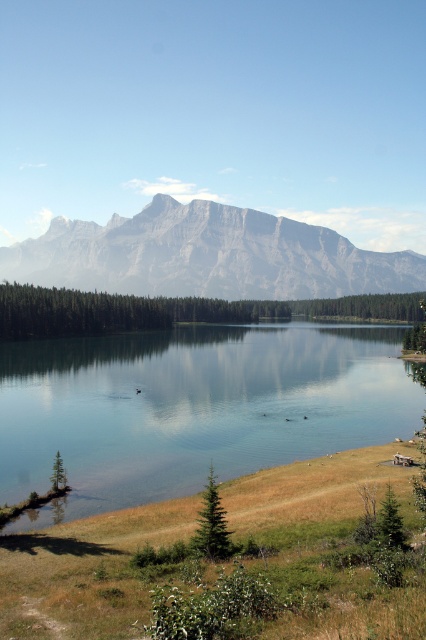
Question: Is gray rock mountain at upper center below green matte tree at lower left?

Choices:
 (A) yes
 (B) no

Answer: (B)

Question: Which of these objects is positioned closest to the green matte tree at lower left?

Choices:
 (A) green leafy trees at center
 (B) gray rock mountain at upper center
 (C) green matte tree at center

Answer: (C)

Question: Can you confirm if green leafy trees at center is positioned to the right of green matte tree at center?

Choices:
 (A) yes
 (B) no

Answer: (A)

Question: Based on their relative distances, which object is farther from the green matte tree at center?

Choices:
 (A) clear glass water at center
 (B) gray rock mountain at upper center
 (C) green leafy trees at center

Answer: (B)

Question: Is green leafy trees at center to the left of green matte tree at center from the viewer's perspective?

Choices:
 (A) no
 (B) yes

Answer: (A)

Question: Based on their relative distances, which object is farther from the gray rock mountain at upper center?

Choices:
 (A) clear glass water at center
 (B) green matte tree at center
 (C) green matte tree at lower left

Answer: (C)